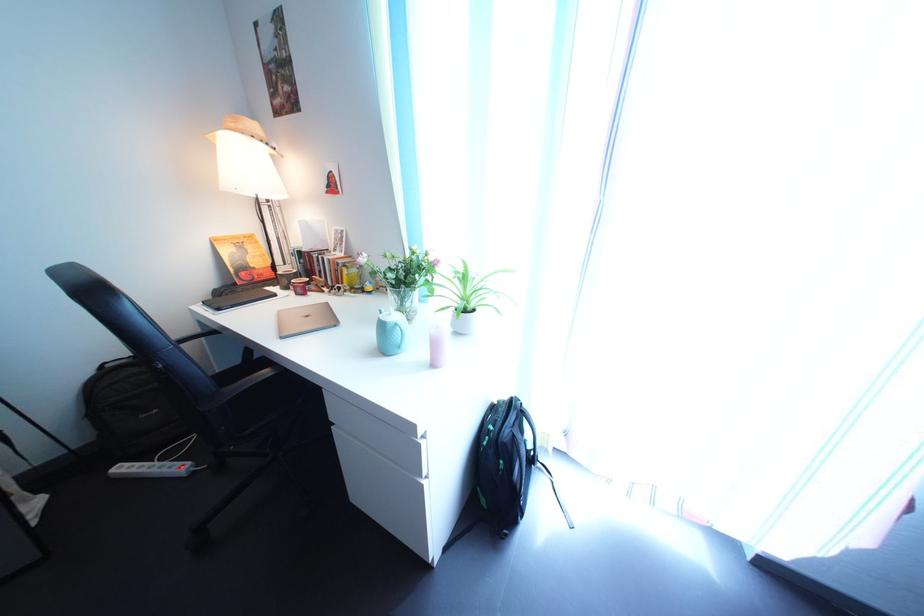
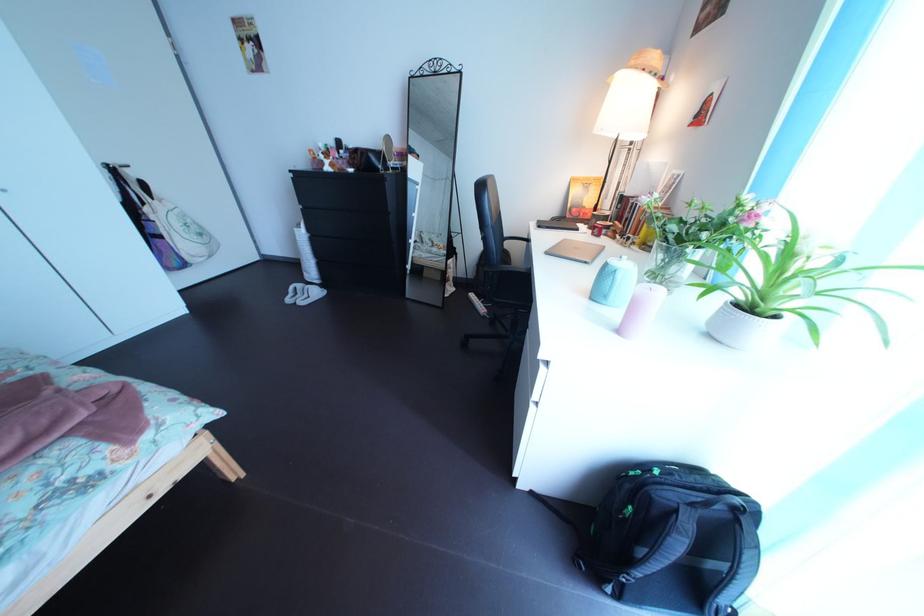
Locate, in the second image, the point that corresponds to (505,436) in the first image.

(672, 480)